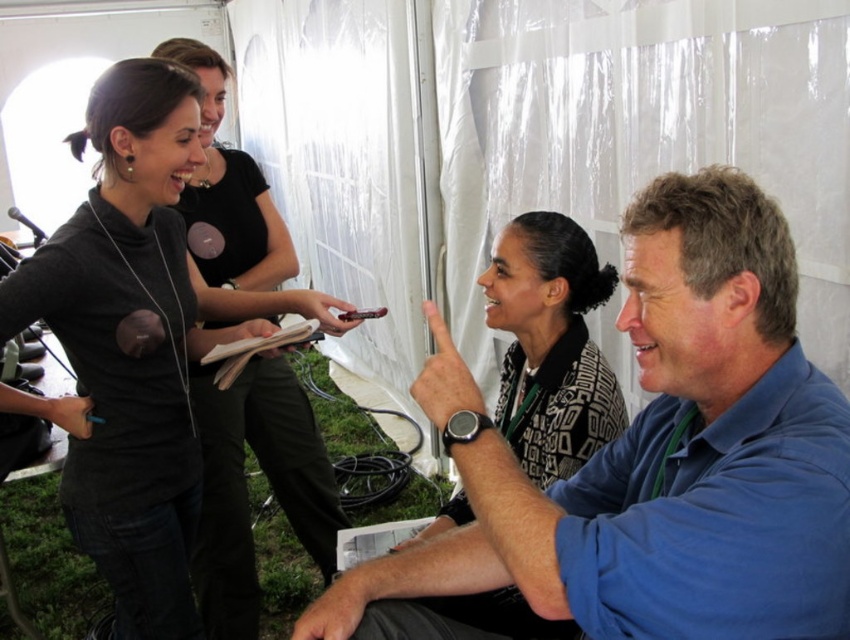
You are standing in the outdoor gathering area and want to take a photo of both the blue cotton shirt at center and the patterned fabric blouse at center. Which one should you focus on first to ensure both are in the frame?

The blue cotton shirt at center is positioned under the patterned fabric blouse at center, so you should focus on the patterned fabric blouse at center first to ensure both are in the frame.

You are standing at the camera position and want to reach the point marked as point (727, 484). Can you estimate how far you need to walk to get there?

The distance between the camera and point (727, 484) is 29.83 inches, so you need to walk approximately 29.83 inches to reach that point.

You are an event organizer arranging seating for a group photo. You have two participants wearing a blue cotton shirt at center and a patterned fabric blouse at center. Which participant should you seat in a larger chair to accommodate their clothing size?

The blue cotton shirt at center is larger in size than the patterned fabric blouse at center, so you should seat the participant wearing the blue cotton shirt at center in a larger chair.